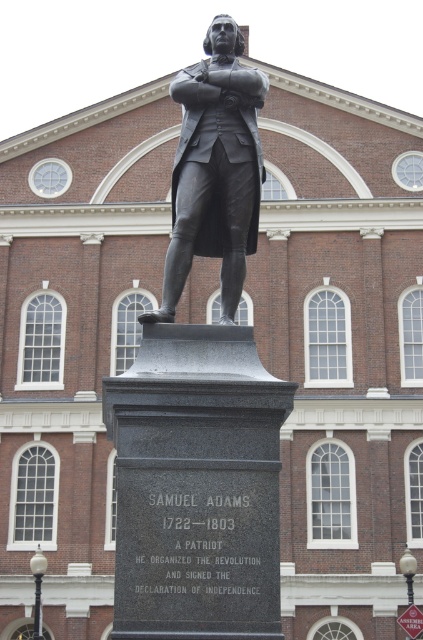
Who is taller, polished bronze statue at center or bronze statue at center?

Standing taller between the two is polished bronze statue at center.

Is point (213, 499) more distant than point (247, 93)?

That is False.

Where is `polished bronze statue at center`? polished bronze statue at center is located at coordinates [x=202, y=394].